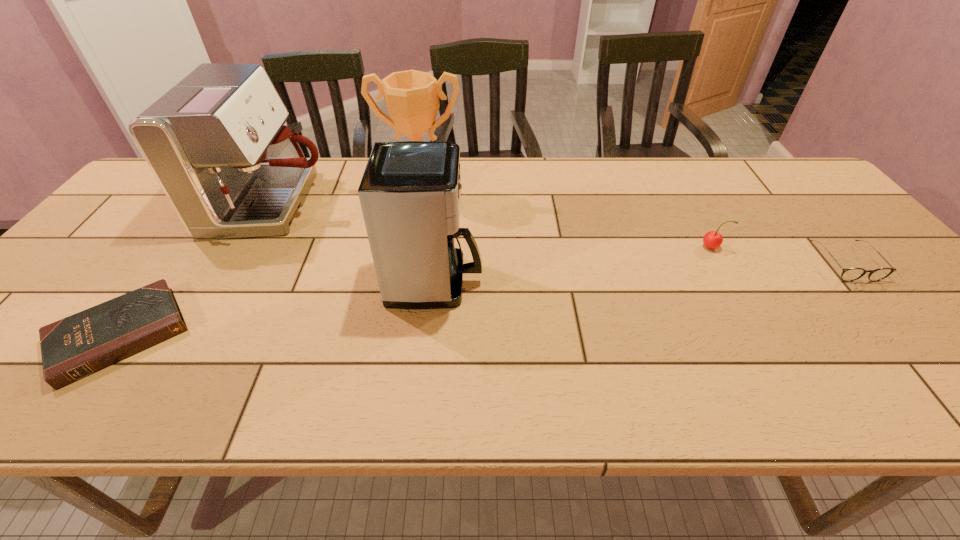
Where is `vacant point located 0.050m on the front panel of the right coffee maker`? vacant point located 0.050m on the front panel of the right coffee maker is located at coordinates (503, 281).

What are the coordinates of `vacant point located 0.270m on the right of the third shortest object` in the screenshot? It's located at (826, 247).

The image size is (960, 540). What are the coordinates of `free space located through the lenses of the rightmost object` in the screenshot? It's located at (911, 340).

Identify the location of vacant space located 0.130m on the back of the shortest object. (180, 252).

Where is `award that is positioned at the far edge`? This screenshot has width=960, height=540. award that is positioned at the far edge is located at coordinates (x=412, y=97).

Where is `coffee maker that is at the far edge`? Image resolution: width=960 pixels, height=540 pixels. coffee maker that is at the far edge is located at coordinates (216, 142).

This screenshot has width=960, height=540. I want to click on object present at the near edge, so click(x=72, y=348).

The height and width of the screenshot is (540, 960). What are the coordinates of `object that is at the left edge` in the screenshot? It's located at click(72, 348).

Where is `object that is at the right edge`? This screenshot has width=960, height=540. object that is at the right edge is located at coordinates (848, 274).

This screenshot has height=540, width=960. In order to click on object positioned at the near left corner in this screenshot , I will do `click(72, 348)`.